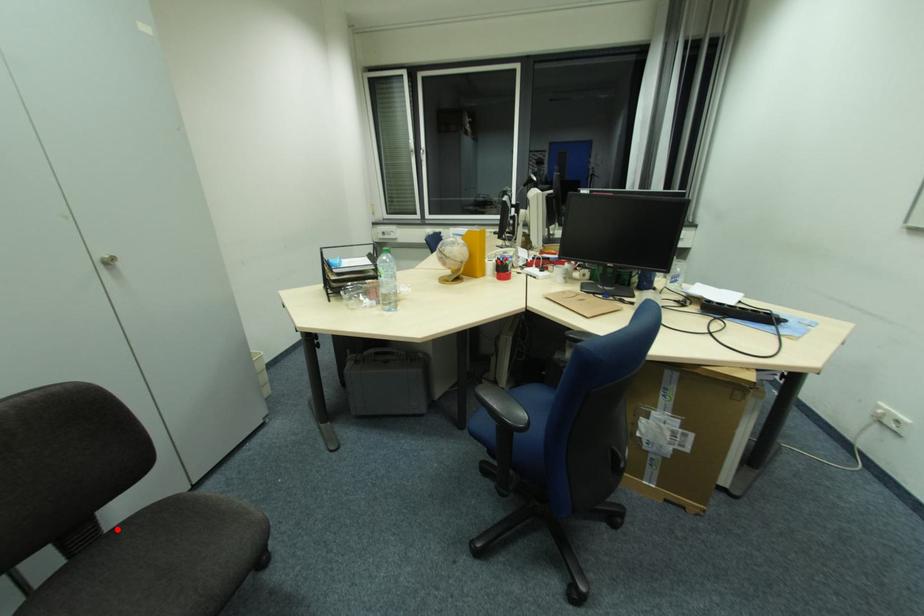
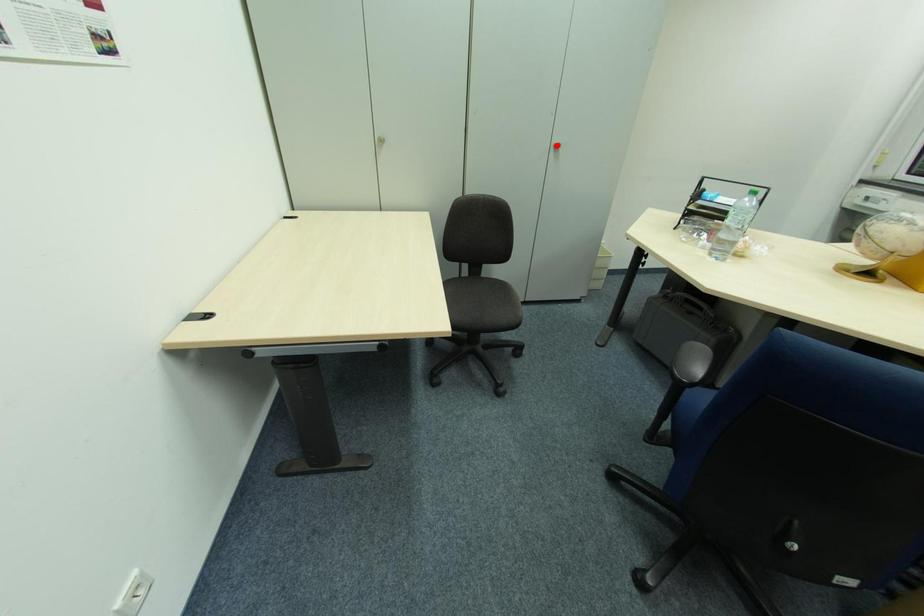
Consider the image. I am providing you with two images of the same scene from different viewpoints. A red point is marked on the first image and another point is marked on the second image. Are the points marked in image1 and image2 representing the same 3D position?

No